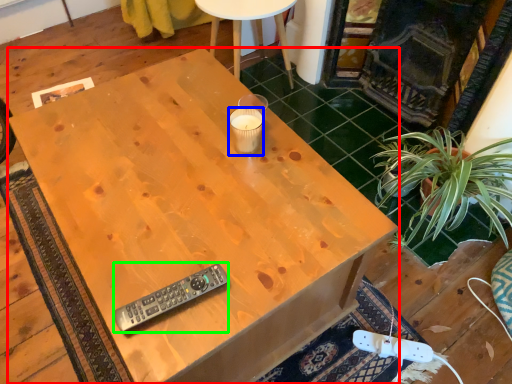
Question: Which object is the closest to the desk (highlighted by a red box)? Choose among these: coffee cup (highlighted by a blue box) or remote control (highlighted by a green box).

Choices:
 (A) coffee cup
 (B) remote control

Answer: (A)